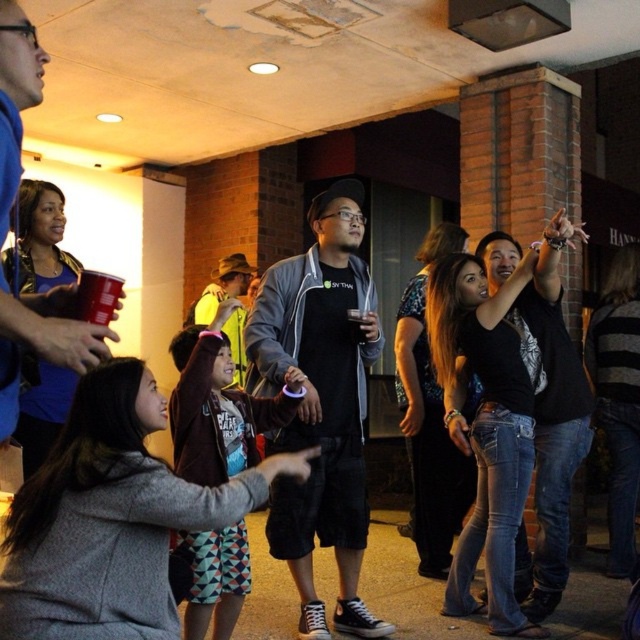
Is multicolored fabric dress at center positioned in front of matte black hoodie at center?

That is False.

Which is in front, point (188, 541) or point (70, 324)?

Positioned in front is point (70, 324).

The height and width of the screenshot is (640, 640). Describe the element at coordinates (220, 404) in the screenshot. I see `multicolored fabric dress at center` at that location.

I want to click on multicolored fabric dress at center, so point(220,404).

Which is below, matte black t-shirt at center or yellow fabric shirt at center?

matte black t-shirt at center is lower down.

Which is behind, point (275, 442) or point (224, 259)?

Point (224, 259)

Locate an element on the screen. The image size is (640, 640). matte black t-shirt at center is located at coordinates (321, 403).

From the picture: Which of these two, matte black t-shirt at center or matte black hoodie at center, stands shorter?

Standing shorter between the two is matte black hoodie at center.

Is the position of matte black t-shirt at center more distant than that of matte black hoodie at center?

Yes.

Which is in front, point (349, 337) or point (40, 88)?

Positioned in front is point (40, 88).

The height and width of the screenshot is (640, 640). I want to click on matte black t-shirt at center, so click(x=321, y=403).